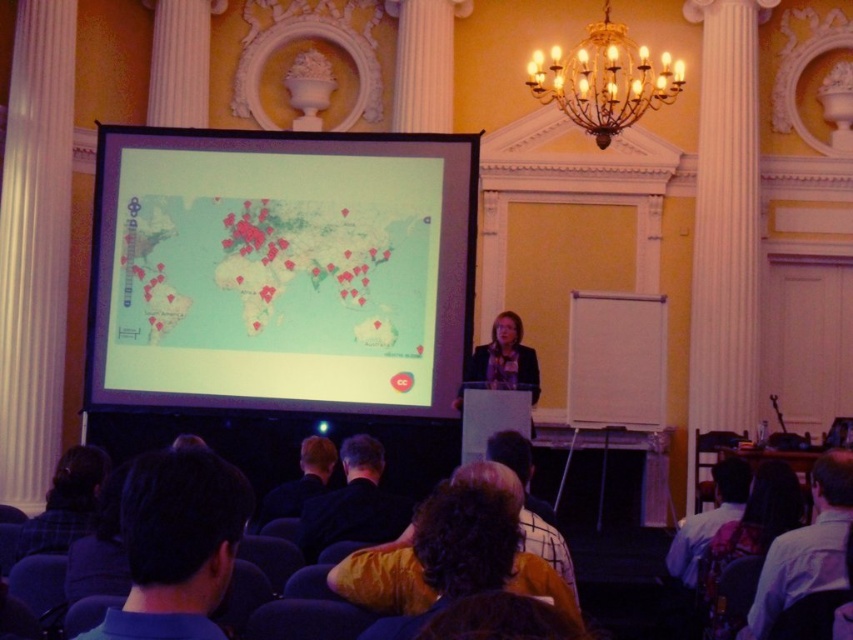
Question: Is light blue shirt at lower right positioned before dark blue shirt at center?

Choices:
 (A) no
 (B) yes

Answer: (B)

Question: Does gold metallic chandelier at upper center have a greater width compared to white shirt at lower right?

Choices:
 (A) yes
 (B) no

Answer: (A)

Question: Which of the following is the closest to the observer?

Choices:
 (A) (822, 490)
 (B) (170, 611)

Answer: (B)

Question: Estimate the real-world distances between objects in this image. Which object is closer to the dark blue shirt at lower left?

Choices:
 (A) gold metallic chandelier at upper center
 (B) matte plastic projector screen at center
 (C) black fabric shirt at lower center
 (D) dark blue shirt at center

Answer: (C)

Question: Does white shirt at lower right appear on the right side of light blue shirt at lower right?

Choices:
 (A) no
 (B) yes

Answer: (B)

Question: Which point is farther from the camera taking this photo?

Choices:
 (A) (242, 221)
 (B) (607, 38)
 (C) (405, 506)

Answer: (B)